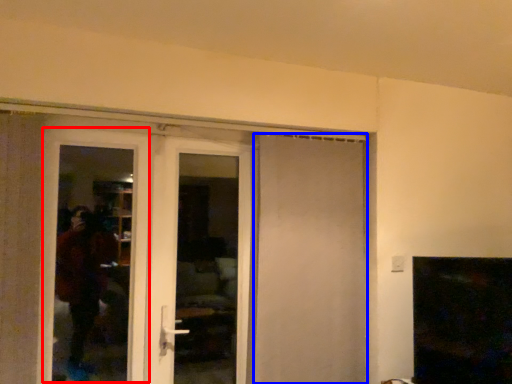
Question: Which of the following is the closest to the observer, screen door (highlighted by a red box) or door (highlighted by a blue box)?

Choices:
 (A) screen door
 (B) door

Answer: (A)